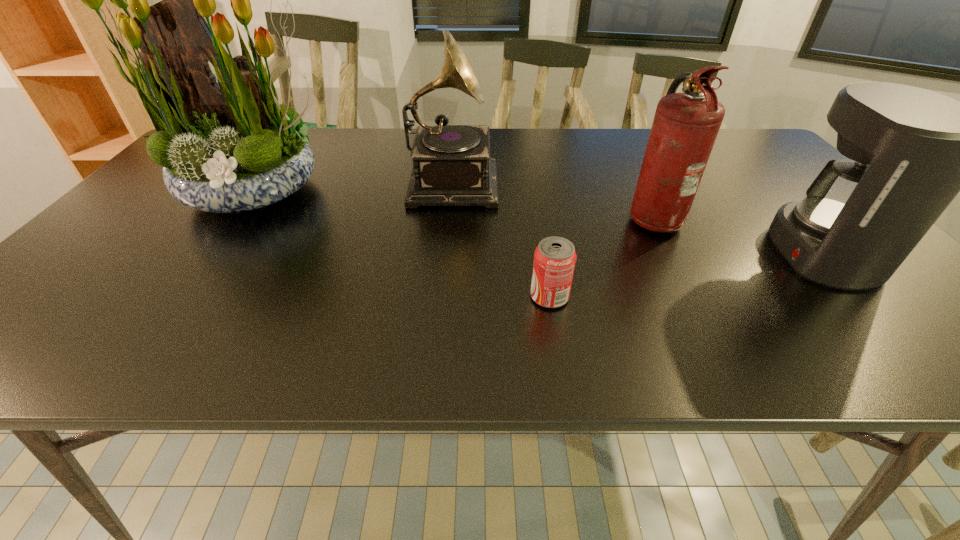
At what (x,y) coordinates should I click in order to perform the action: click on blank region between the fire extinguisher and the fourth object from right to left. Please return your answer as a coordinate pair (x, y). This screenshot has height=540, width=960. Looking at the image, I should click on (552, 198).

Find the location of `free space between the flower arrangement and the shortest object`. free space between the flower arrangement and the shortest object is located at coordinates point(402,244).

The height and width of the screenshot is (540, 960). I want to click on unoccupied position between the record player and the shortest object, so click(500, 238).

In order to click on object that is the second closest to the third object from left to right in this screenshot , I will do `click(452, 166)`.

Locate an element on the screen. Image resolution: width=960 pixels, height=540 pixels. object that is the second closest to the coffee maker is located at coordinates (555, 257).

Locate an element on the screen. free space in the image that satisfies the following two spatial constraints: 1. on the horn of the record player; 2. on the front-facing side of the flower arrangement is located at coordinates coord(450,191).

Where is `free space that satisfies the following two spatial constraints: 1. on the back side of the third object from left to right; 2. on the horn of the record player`? free space that satisfies the following two spatial constraints: 1. on the back side of the third object from left to right; 2. on the horn of the record player is located at coordinates (530, 180).

Find the location of a particular element. Image resolution: width=960 pixels, height=540 pixels. free location that satisfies the following two spatial constraints: 1. on the front-facing side of the tallest object; 2. on the left side of the shortest object is located at coordinates (180, 296).

This screenshot has height=540, width=960. In order to click on free location that satisfies the following two spatial constraints: 1. on the horn of the third object from left to right; 2. on the right side of the fourth object from right to left in this screenshot , I will do `click(441, 296)`.

Identify the location of vacant point that satisfies the following two spatial constraints: 1. on the front-facing side of the third object from right to left; 2. on the left side of the tallest object. (180, 296).